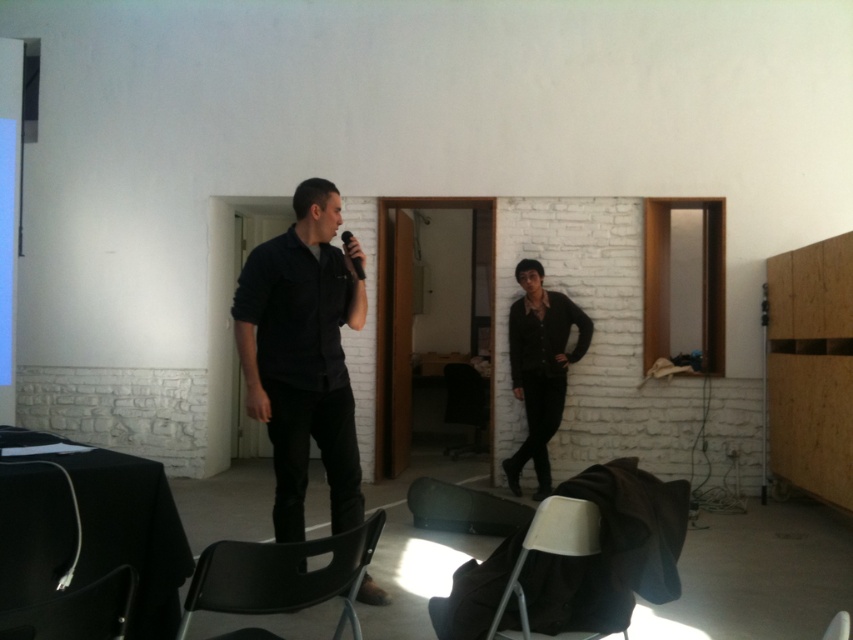
Between black plastic chair at lower center and matte black chair at lower center, which one appears on the left side from the viewer's perspective?

black plastic chair at lower center is more to the left.

Can you confirm if black plastic chair at lower center is smaller than matte black chair at lower center?

No, black plastic chair at lower center is not smaller than matte black chair at lower center.

Between point (281, 580) and point (598, 545), which one is positioned in front?

Point (281, 580)

What are the coordinates of `black plastic chair at lower center` in the screenshot? It's located at pyautogui.click(x=282, y=576).

Which is in front, point (106, 614) or point (358, 269)?

Point (106, 614) is more forward.

Who is positioned more to the left, black plastic chair at lower left or black matte microphone at center?

black plastic chair at lower left is more to the left.

Is point (100, 618) positioned behind point (360, 276)?

No.

Locate an element on the screen. The width and height of the screenshot is (853, 640). black plastic chair at lower left is located at coordinates (76, 611).

Is black plastic chair at lower left wider than matte black chair at lower center?

In fact, black plastic chair at lower left might be narrower than matte black chair at lower center.

Which is more to the left, black plastic chair at lower left or matte black chair at lower center?

black plastic chair at lower left is more to the left.

Is point (86, 604) positioned in front of point (492, 627)?

That is True.

The height and width of the screenshot is (640, 853). Identify the location of black plastic chair at lower left. (76, 611).